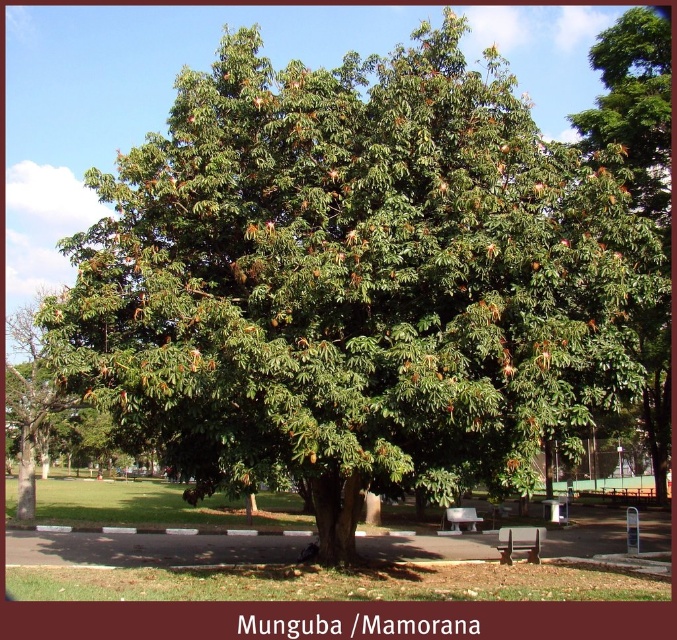
Question: Estimate the real-world distances between objects in this image. Which object is farther from the brown wooden bench at lower center?

Choices:
 (A) wooden bench at lower right
 (B) green leafy tree at center
 (C) white plastic bench at center

Answer: (B)

Question: Which point appears closest to the camera in this image?

Choices:
 (A) 464,522
 (B) 567,509
 (C) 640,406

Answer: (A)

Question: Which of the following is the farthest from the observer?

Choices:
 (A) (640, 163)
 (B) (531, 531)
 (C) (550, 506)

Answer: (C)

Question: Does green leafy tree at center come in front of brown wooden bench at lower center?

Choices:
 (A) yes
 (B) no

Answer: (A)

Question: Does green leafy tree at center have a greater width compared to white plastic bench at center?

Choices:
 (A) yes
 (B) no

Answer: (A)

Question: Is brown wooden bench at lower center closer to camera compared to white plastic bench at center?

Choices:
 (A) no
 (B) yes

Answer: (B)